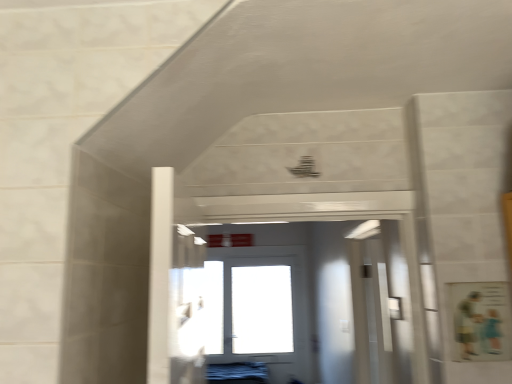
Question: Which direction should I rotate to face white glossy door at center, marked as the first door in a front-to-back arrangement, — up or down?

Choices:
 (A) up
 (B) down

Answer: (B)

Question: Is white glossy door at center, marked as the first door in a front-to-back arrangement, not near white glossy door at center, arranged as the 2th door when viewed from the top?

Choices:
 (A) no
 (B) yes

Answer: (A)

Question: Can you confirm if white glossy door at center, the 1th door from the top, is wider than white glossy door at center, which is the first door from back to front?

Choices:
 (A) no
 (B) yes

Answer: (B)

Question: Considering the relative sizes of white glossy door at center, the 1th door from the top, and white glossy door at center, arranged as the first door when ordered from the bottom, in the image provided, is white glossy door at center, the 1th door from the top, thinner than white glossy door at center, arranged as the first door when ordered from the bottom,?

Choices:
 (A) yes
 (B) no

Answer: (B)

Question: From a real-world perspective, is white glossy door at center, the 1th door from the top, located higher than white glossy door at center, arranged as the 2th door when viewed from the top?

Choices:
 (A) yes
 (B) no

Answer: (A)

Question: Is white glossy door at center, marked as the first door in a front-to-back arrangement, outside white glossy door at center, arranged as the 2th door when viewed from the top?

Choices:
 (A) yes
 (B) no

Answer: (A)

Question: From the image's perspective, does white glossy door at center, the 1th door from the top, appear lower than white glossy door at center, which is counted as the 2th door, starting from the front?

Choices:
 (A) no
 (B) yes

Answer: (A)

Question: Is white glossy door at center, which is the first door from back to front, further to the viewer compared to white glossy door at center, placed as the 2th door when sorted from bottom to top?

Choices:
 (A) yes
 (B) no

Answer: (A)

Question: Is white glossy door at center, arranged as the 2th door when viewed from the top, outside white glossy door at center, placed as the 2th door when sorted from bottom to top?

Choices:
 (A) no
 (B) yes

Answer: (B)

Question: Is white glossy door at center, which is counted as the 2th door, starting from the front, bigger than white glossy door at center, marked as the first door in a front-to-back arrangement?

Choices:
 (A) yes
 (B) no

Answer: (A)

Question: From a real-world perspective, is white glossy door at center, arranged as the 2th door when viewed from the top, over white glossy door at center, placed as the 2th door when sorted from bottom to top?

Choices:
 (A) no
 (B) yes

Answer: (A)

Question: Considering the relative sizes of white glossy door at center, arranged as the first door when ordered from the bottom, and white glossy door at center, placed as the 2th door when sorted from bottom to top, in the image provided, is white glossy door at center, arranged as the first door when ordered from the bottom, wider than white glossy door at center, placed as the 2th door when sorted from bottom to top,?

Choices:
 (A) no
 (B) yes

Answer: (A)

Question: Is white glossy door at center, which is the first door from back to front, placed right next to white glossy door at center, marked as the first door in a front-to-back arrangement?

Choices:
 (A) no
 (B) yes

Answer: (A)

Question: Is white glossy door at center, which is the first door from back to front, inside or outside of white glossy door at center, the 1th door from the top?

Choices:
 (A) inside
 (B) outside

Answer: (B)